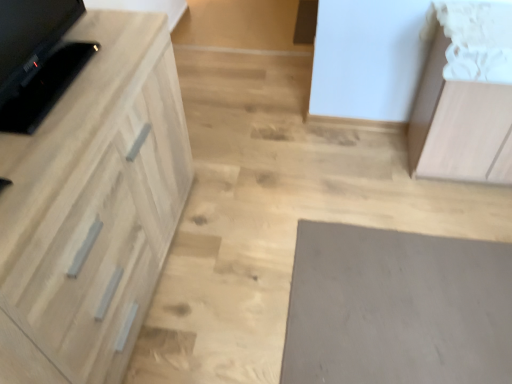
Locate an element on the screen. This screenshot has height=384, width=512. unoccupied space behind gray matte mat at lower right is located at coordinates (352, 182).